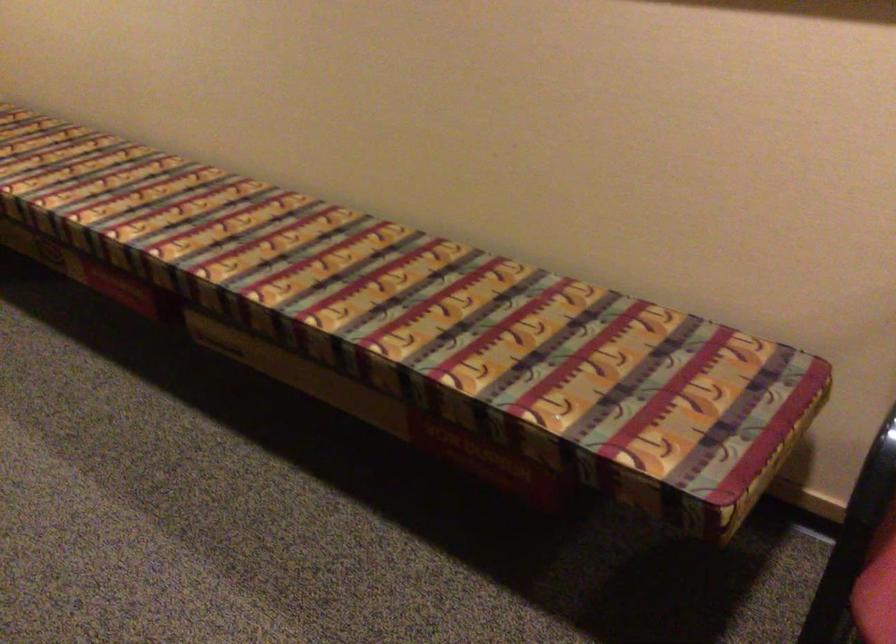
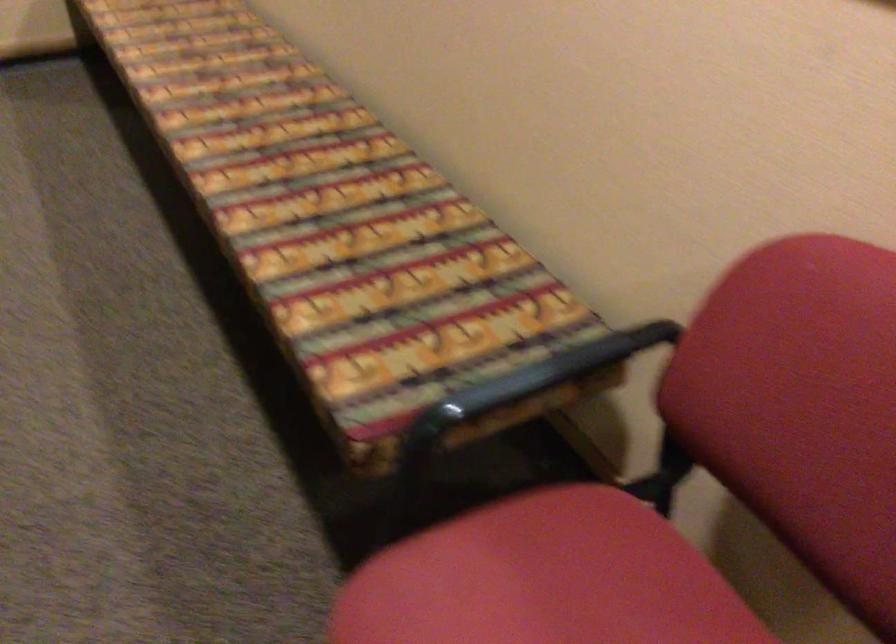
Question: Which direction would the cameraman need to move to produce the second image? Reply with the corresponding letter.

Choices:
 (A) Left
 (B) Right
 (C) Forward
 (D) Backward

Answer: (B)